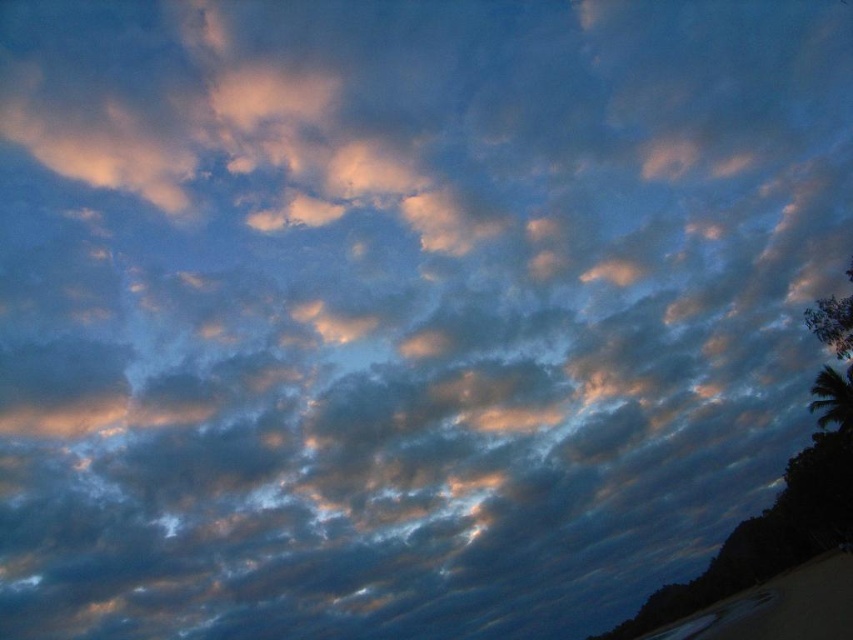
You are standing on the beach and want to take a photo of the sunset. You notice the sandy beach at lower right and the green leafy palm tree at lower right. Which object is closer to the left side of the photo?

The sandy beach at lower right is positioned on the left side of the green leafy palm tree at lower right, so the sandy beach at lower right is closer to the left side of the photo.

Consider the image. You are standing on the sandy beach at lower right and want to take a photo of the green leafy palm tree at lower right. Since the palm tree is smaller than the beach in the image, will the palm tree appear smaller in the photo compared to the beach?

Yes, the green leafy palm tree at lower right appears smaller than the sandy beach at lower right in the photo because the sandy beach at lower right is bigger according to the description.